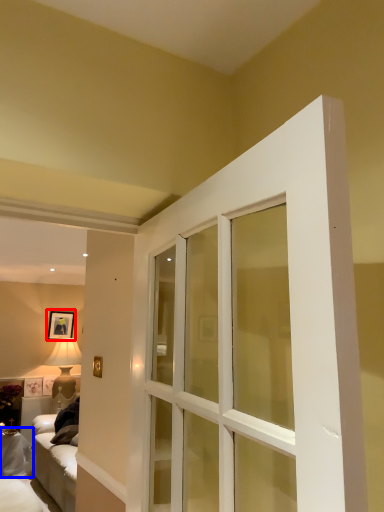
Question: Which point is further to the camera, picture frame (highlighted by a red box) or furniture (highlighted by a blue box)?

Choices:
 (A) picture frame
 (B) furniture

Answer: (A)